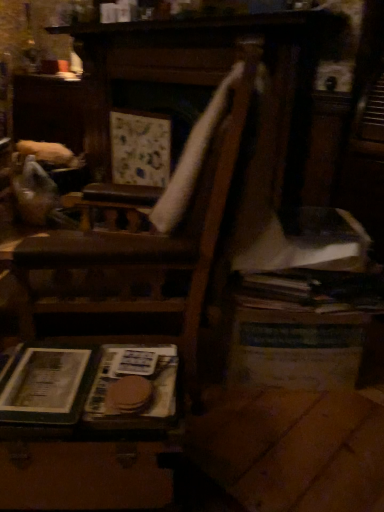
Question: Considering the relative sizes of wooden suitcase at lower left, which ranks as the second table in back-to-front order, and hardcover book at lower left, which appears as the second paperback book when viewed from the right, in the image provided, is wooden suitcase at lower left, which ranks as the second table in back-to-front order, smaller than hardcover book at lower left, which appears as the second paperback book when viewed from the right,?

Choices:
 (A) yes
 (B) no

Answer: (B)

Question: From the image's perspective, is wooden suitcase at lower left, the 1th table from the front, on hardcover book at lower left, acting as the first paperback book starting from the left?

Choices:
 (A) no
 (B) yes

Answer: (A)

Question: Is wooden suitcase at lower left, which ranks as the second table in back-to-front order, not within hardcover book at lower left, which appears as the second paperback book when viewed from the right?

Choices:
 (A) yes
 (B) no

Answer: (A)

Question: Is wooden suitcase at lower left, which ranks as the second table in back-to-front order, turned away from hardcover book at lower left, which appears as the second paperback book when viewed from the right?

Choices:
 (A) no
 (B) yes

Answer: (A)

Question: Can you confirm if wooden suitcase at lower left, the second table from the right, is thinner than hardcover book at lower left, which appears as the second paperback book when viewed from the right?

Choices:
 (A) yes
 (B) no

Answer: (B)

Question: Considering the positions of wooden suitcase at lower left, which ranks as the second table in back-to-front order, and brown paper at lower left, the second paperback book viewed from the left, in the image, is wooden suitcase at lower left, which ranks as the second table in back-to-front order, wider or thinner than brown paper at lower left, the second paperback book viewed from the left,?

Choices:
 (A) wide
 (B) thin

Answer: (A)

Question: Considering the positions of wooden suitcase at lower left, the 1th table from the front, and brown paper at lower left, the second paperback book viewed from the left, in the image, is wooden suitcase at lower left, the 1th table from the front, taller or shorter than brown paper at lower left, the second paperback book viewed from the left,?

Choices:
 (A) short
 (B) tall

Answer: (B)

Question: Which is correct: wooden suitcase at lower left, the second table from the right, is inside brown paper at lower left, the first paperback book positioned from the right, or outside of it?

Choices:
 (A) inside
 (B) outside

Answer: (B)

Question: From the image's perspective, is wooden suitcase at lower left, the second table from the right, positioned above or below brown paper at lower left, the second paperback book viewed from the left?

Choices:
 (A) above
 (B) below

Answer: (B)

Question: From a real-world perspective, relative to hardcover book at lower left, acting as the first paperback book starting from the left, is wooden suitcase at lower left, the 1th table from the front, vertically above or below?

Choices:
 (A) below
 (B) above

Answer: (A)

Question: From the image's perspective, relative to hardcover book at lower left, which appears as the second paperback book when viewed from the right, is wooden suitcase at lower left, the 1th table from the front, above or below?

Choices:
 (A) above
 (B) below

Answer: (B)

Question: Is wooden suitcase at lower left, which ranks as the second table in back-to-front order, to the left or to the right of hardcover book at lower left, which appears as the second paperback book when viewed from the right, in the image?

Choices:
 (A) right
 (B) left

Answer: (A)

Question: Is wooden suitcase at lower left, the 1th table from the front, wider or thinner than hardcover book at lower left, which appears as the second paperback book when viewed from the right?

Choices:
 (A) thin
 (B) wide

Answer: (B)

Question: Is hardcover book at lower left, which appears as the second paperback book when viewed from the right, in front of or behind wooden table at lower right, the second table viewed from the front, in the image?

Choices:
 (A) behind
 (B) front

Answer: (B)

Question: From the image's perspective, relative to wooden table at lower right, marked as the 1th table in a back-to-front arrangement, is hardcover book at lower left, which appears as the second paperback book when viewed from the right, above or below?

Choices:
 (A) above
 (B) below

Answer: (B)